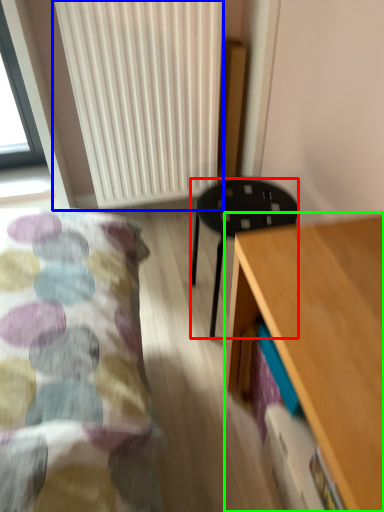
Question: Estimate the real-world distances between objects in this image. Which object is closer to stool (highlighted by a red box), radiator (highlighted by a blue box) or desk (highlighted by a green box)?

Choices:
 (A) radiator
 (B) desk

Answer: (B)